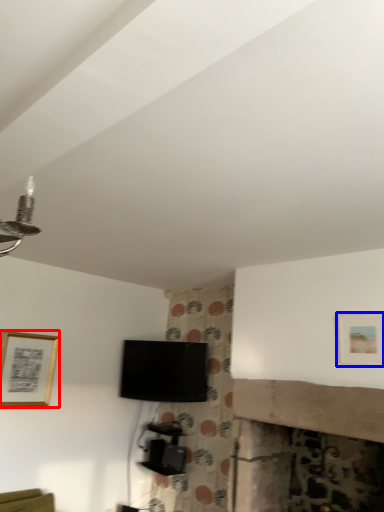
Question: Among these objects, which one is nearest to the camera, picture frame (highlighted by a red box) or picture frame (highlighted by a blue box)?

Choices:
 (A) picture frame
 (B) picture frame

Answer: (B)